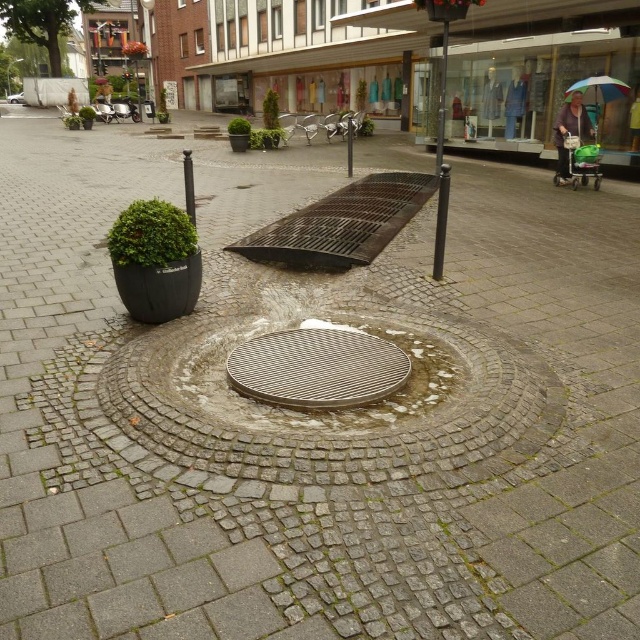
You are standing in the plaza and want to take a photo of both point (294, 339) and point (611, 80) in the scene. Which point should you focus on first to ensure both are in clear view?

You should focus on point (294, 339) first because it is closer to the camera than point (611, 80), ensuring both points are in focus when using depth of field.

You are standing at the center of the plaza with a 4 meter long rope. You want to reach the point marked at coordinates point (x=390, y=369) without moving your feet. Can you do it by stretching the rope?

The point marked at coordinates point (x=390, y=369) is 3.62 meters away from the camera. Since the rope is 4 meters long, which is longer than the distance, you can reach it by stretching the rope.